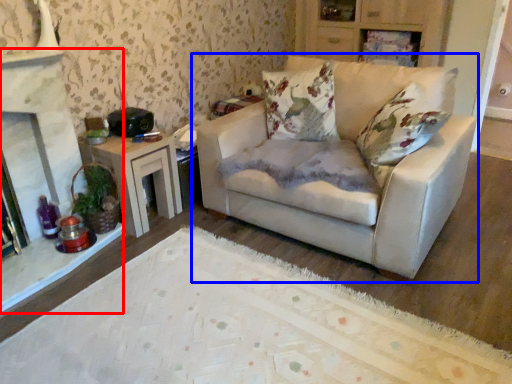
Question: Which object appears closest to the camera in this image, fireplace (highlighted by a red box) or studio couch (highlighted by a blue box)?

Choices:
 (A) fireplace
 (B) studio couch

Answer: (B)